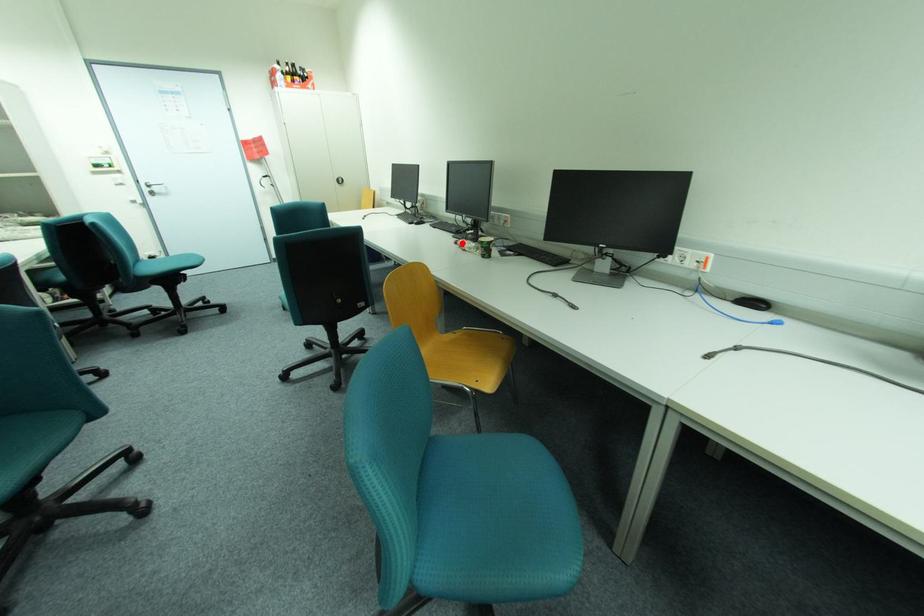
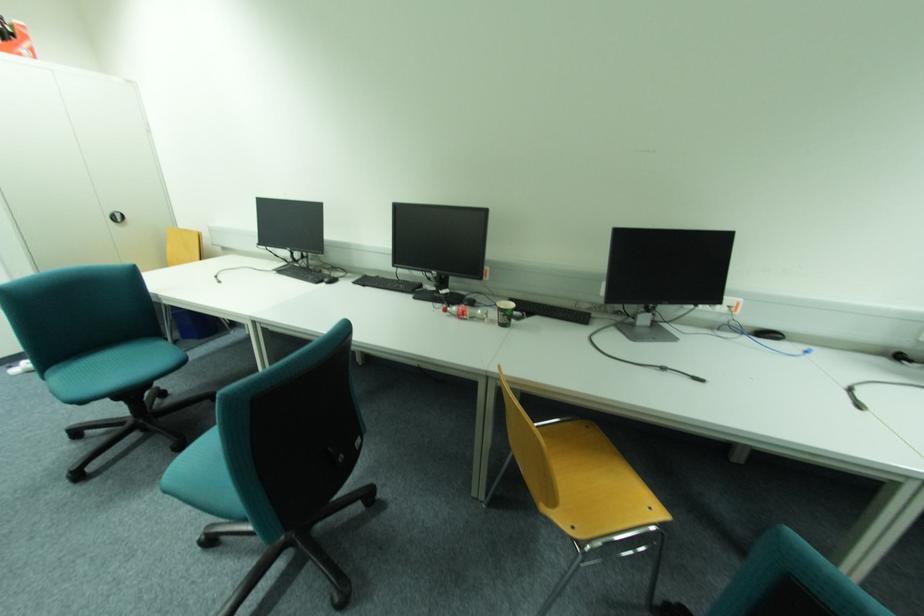
Find the pixel in the second image that matches the highlighted location in the first image.

(451, 310)